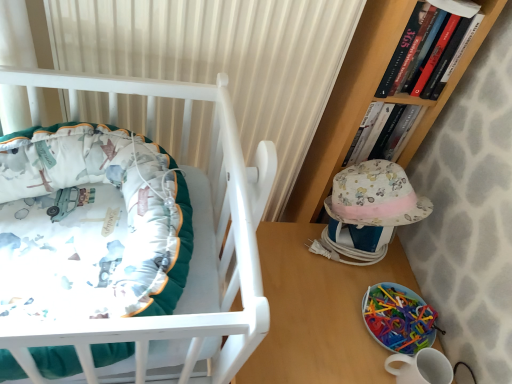
Question: From the image's perspective, is wooden table at lower right located above or below translucent plastic toy at lower right?

Choices:
 (A) above
 (B) below

Answer: (B)

Question: Considering the relative positions of wooden table at lower right and translucent plastic toy at lower right in the image provided, is wooden table at lower right to the left or to the right of translucent plastic toy at lower right?

Choices:
 (A) left
 (B) right

Answer: (A)

Question: Which of these objects is positioned farthest from the hardcover book at upper right, placed as the second book when sorted from back to front?

Choices:
 (A) matte white crib at left
 (B) hardcover book at upper right, the 2th book viewed from the front
 (C) translucent plastic toy at lower right
 (D) wooden table at lower right

Answer: (A)

Question: Which object is the farthest from the wooden table at lower right?

Choices:
 (A) hardcover book at upper right, the 2th book viewed from the front
 (B) matte white crib at left
 (C) hardcover book at upper right, which is the first book in front-to-back order
 (D) translucent plastic toy at lower right

Answer: (C)